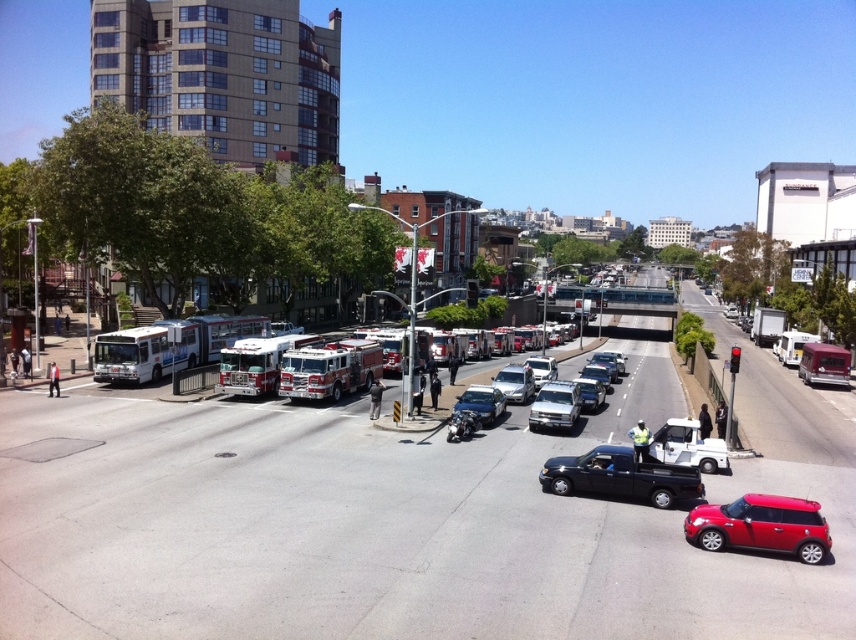
Between shiny silver fire truck at left and white glossy sedan at center, which one has more height?

Standing taller between the two is shiny silver fire truck at left.

Can you confirm if shiny silver fire truck at left is positioned to the left of white glossy sedan at center?

Correct, you'll find shiny silver fire truck at left to the left of white glossy sedan at center.

Is point (242, 364) positioned before point (521, 381)?

That is True.

Locate an element on the screen. The width and height of the screenshot is (856, 640). shiny silver fire truck at left is located at coordinates (257, 362).

Who is lower down, metallic silver sedan at center or white matte truck at center?

metallic silver sedan at center is lower down.

Measure the distance between point (556, 424) and camera.

Point (556, 424) and camera are 88.19 feet apart.

Which is behind, point (471, 404) or point (551, 365)?

Positioned behind is point (551, 365).

Find the location of `metallic silver sedan at center`. metallic silver sedan at center is located at coordinates (500, 392).

Can you confirm if metallic silver car at center is positioned above matte white truck at center?

Indeed, metallic silver car at center is positioned over matte white truck at center.

Who is higher up, metallic silver car at center or matte white truck at center?

metallic silver car at center

Does point (467, 408) come farther from viewer compared to point (596, 397)?

That is False.

This screenshot has width=856, height=640. I want to click on metallic silver car at center, so click(x=480, y=403).